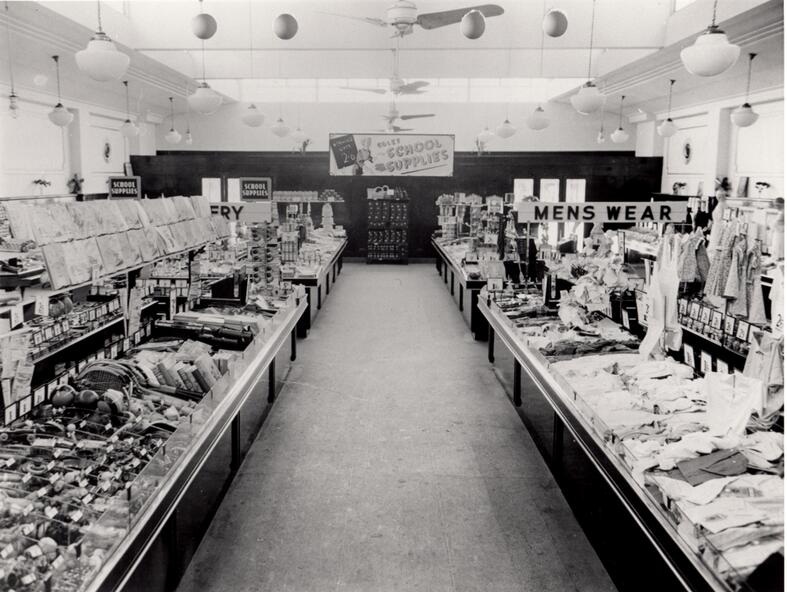
I want to click on hanging lights closest to front of image, so click(102, 65), click(711, 57).